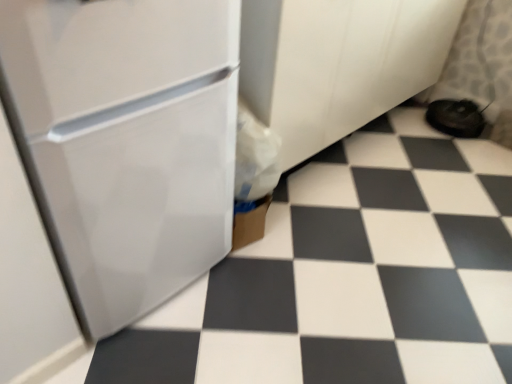
Question: Is black fabric shoe at lower right spatially inside white glossy refrigerator at left, or outside of it?

Choices:
 (A) outside
 (B) inside

Answer: (A)

Question: From the image's perspective, is black fabric shoe at lower right above or below white glossy refrigerator at left?

Choices:
 (A) below
 (B) above

Answer: (B)

Question: Estimate the real-world distances between objects in this image. Which object is closer to the black fabric shoe at lower right?

Choices:
 (A) white glossy refrigerator at left
 (B) white glossy tile at center

Answer: (B)

Question: Which object is positioned closest to the black fabric shoe at lower right?

Choices:
 (A) white glossy refrigerator at left
 (B) white glossy tile at center

Answer: (B)